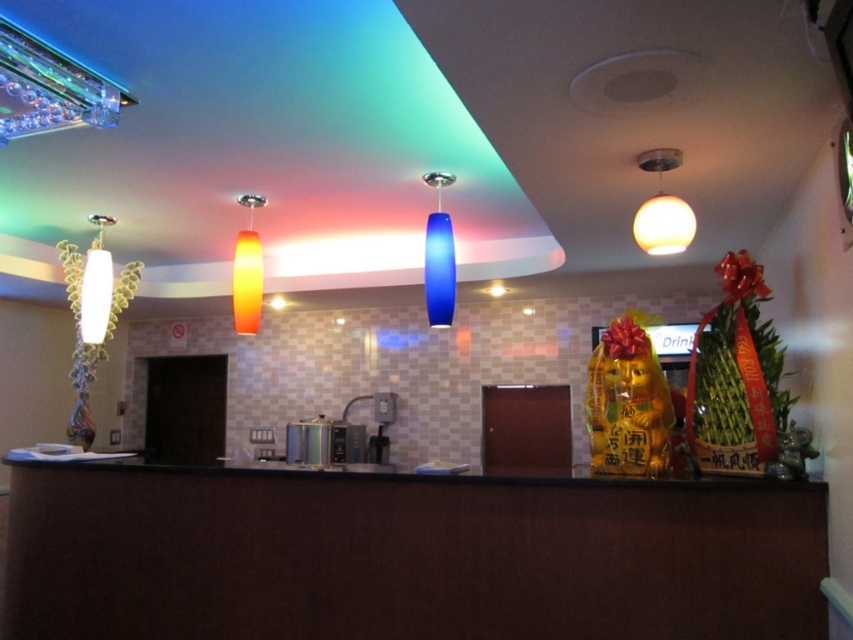
Does orange matte lamp at center have a lesser width compared to white glossy lamp at left?

Correct, orange matte lamp at center's width is less than white glossy lamp at left's.

In order to click on orange matte lamp at center in this screenshot , I will do `click(247, 272)`.

Who is more forward, (244, 246) or (108, 275)?

Point (244, 246)

Find the location of a particular element. Image resolution: width=853 pixels, height=640 pixels. orange matte lamp at center is located at coordinates (247, 272).

Is white glossy sphere at upper right to the right of blue glass pendant at center from the viewer's perspective?

Correct, you'll find white glossy sphere at upper right to the right of blue glass pendant at center.

Does white glossy sphere at upper right appear over blue glass pendant at center?

Indeed, white glossy sphere at upper right is positioned over blue glass pendant at center.

Describe the element at coordinates (662, 209) in the screenshot. I see `white glossy sphere at upper right` at that location.

Find the location of a particular element. The height and width of the screenshot is (640, 853). white glossy sphere at upper right is located at coordinates (662, 209).

Is white glossy sphere at upper right to the right of white glossy lamp at left from the viewer's perspective?

Correct, you'll find white glossy sphere at upper right to the right of white glossy lamp at left.

Identify the location of white glossy sphere at upper right. (662, 209).

I want to click on white glossy sphere at upper right, so click(x=662, y=209).

You are a GUI agent. You are given a task and a screenshot of the screen. Output one action in this format:
    pyautogui.click(x=<x>, y=<y>)
    Task: Click on the white glossy sphere at upper right
    This screenshot has height=640, width=853.
    Given the screenshot: What is the action you would take?
    click(662, 209)